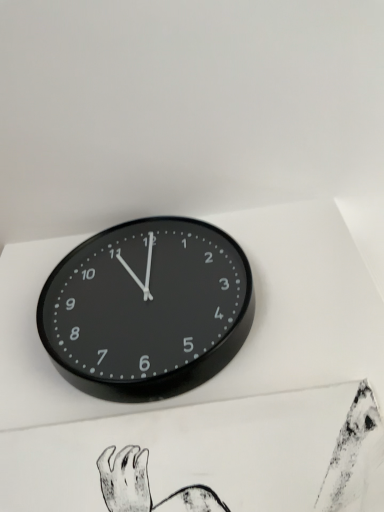
This screenshot has width=384, height=512. What do you see at coordinates (147, 309) in the screenshot?
I see `black matte clock at center` at bounding box center [147, 309].

You are a GUI agent. You are given a task and a screenshot of the screen. Output one action in this format:
    pyautogui.click(x=<x>, y=<y>)
    Task: Click on the black matte clock at center
    
    Given the screenshot: What is the action you would take?
    pyautogui.click(x=147, y=309)

Locate an element on the screen. The height and width of the screenshot is (512, 384). black matte clock at center is located at coordinates point(147,309).